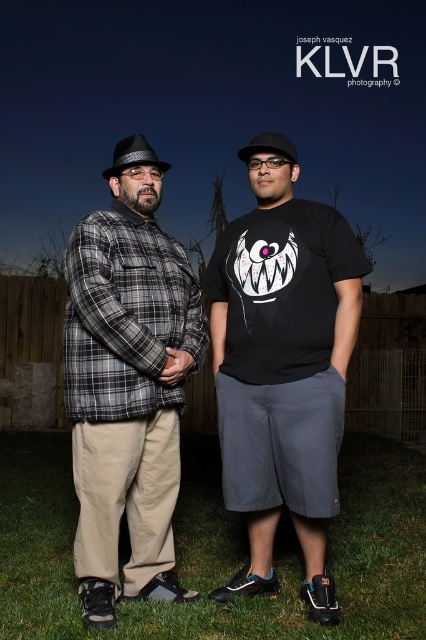
Question: Does matte black t-shirt at center have a greater width compared to plaid fabric shirt at left?

Choices:
 (A) yes
 (B) no

Answer: (A)

Question: Can you confirm if matte black t-shirt at center is positioned below plaid fabric shirt at left?

Choices:
 (A) no
 (B) yes

Answer: (A)

Question: Among these objects, which one is farthest from the camera?

Choices:
 (A) plaid fabric shirt at left
 (B) matte black t-shirt at center

Answer: (B)

Question: Can you confirm if matte black t-shirt at center is bigger than plaid fabric shirt at left?

Choices:
 (A) no
 (B) yes

Answer: (B)